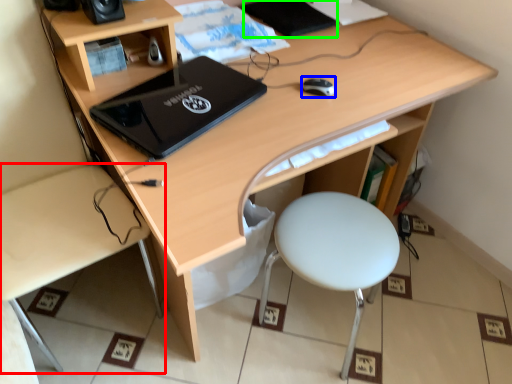
Question: Which object is the closest to the desk (highlighted by a red box)? Choose among these: mouse (highlighted by a blue box) or notebook (highlighted by a green box).

Choices:
 (A) mouse
 (B) notebook

Answer: (A)